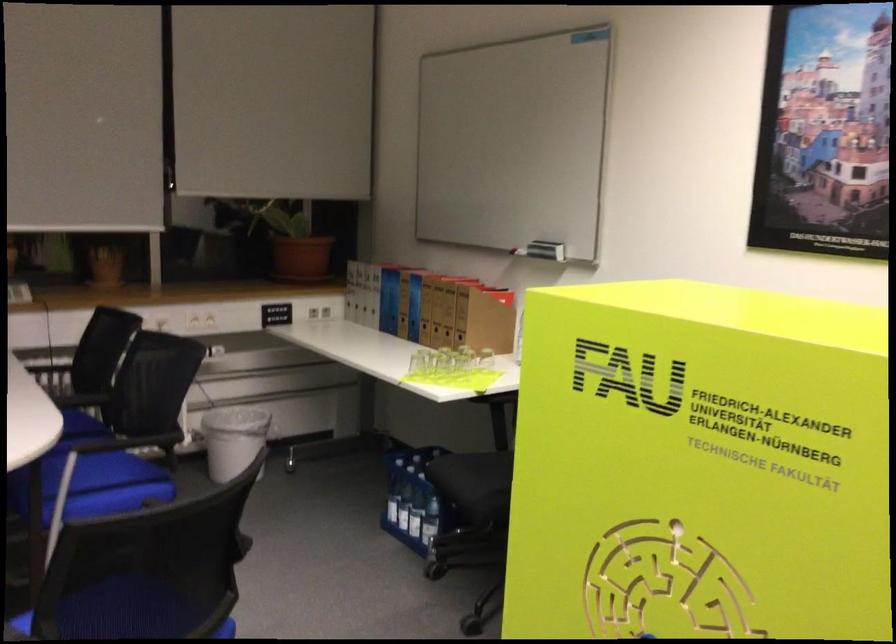
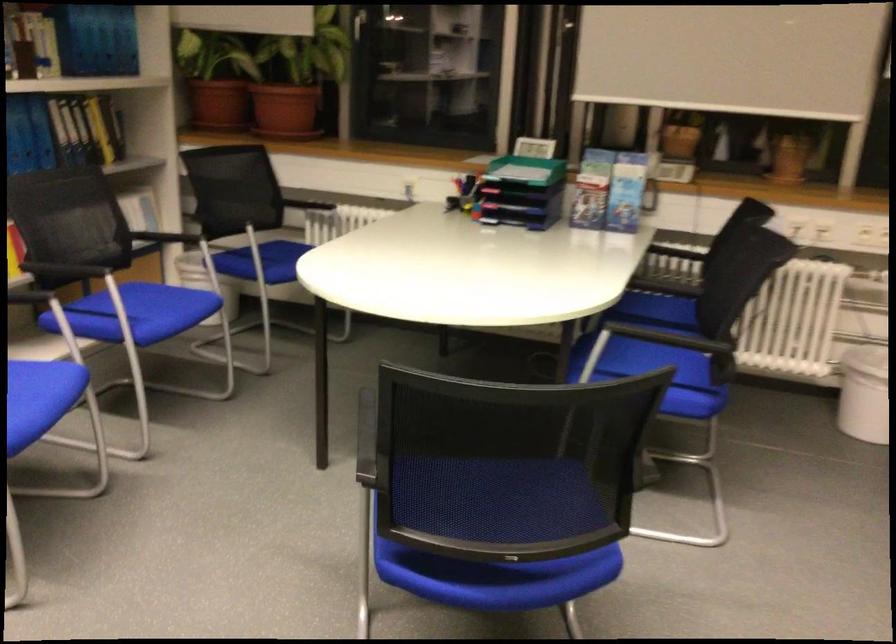
Question: The camera is either moving clockwise (left) or counter-clockwise (right) around the object. The first image is from the beginning of the video and the second image is from the end. Is the camera moving left or right when shooting the video?

Choices:
 (A) Left
 (B) Right

Answer: (B)